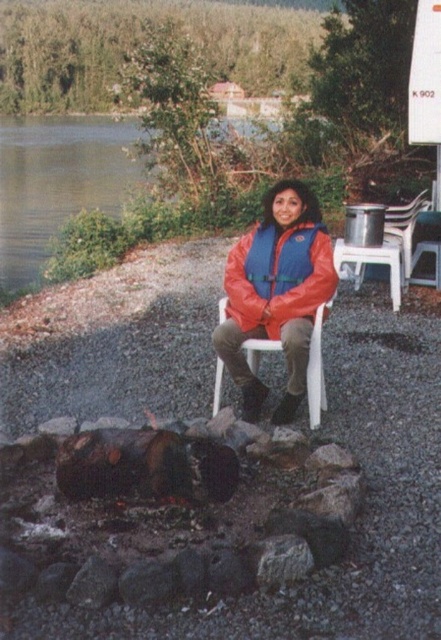
You are planning to place a small decorative rock on the side of the matte orange life vest at center. Considering the space available, would the green grass at upper center provide enough room for the rock?

The matte orange life vest at center has a lesser width compared to green grass at upper center, so placing the small decorative rock next to the matte orange life vest at center would have enough space provided by the green grass at upper center.